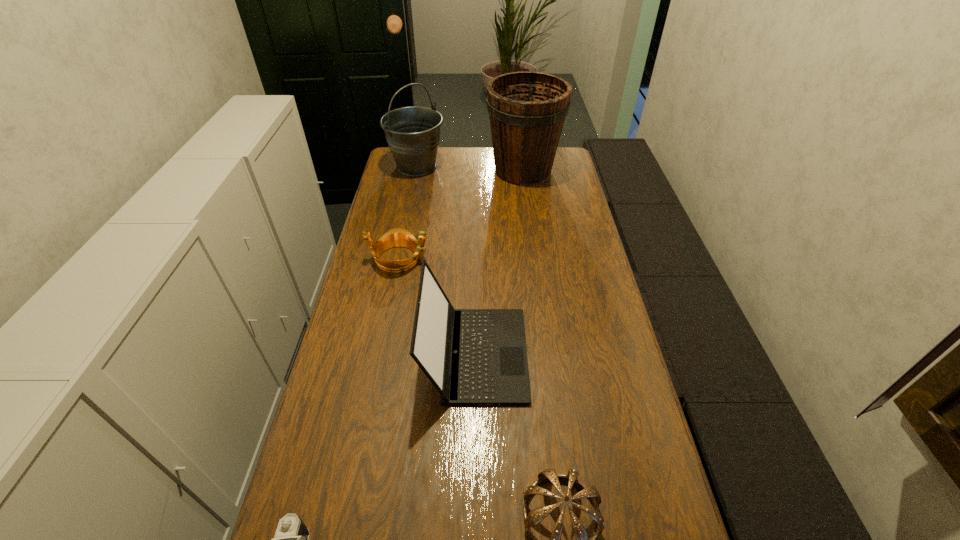
I want to click on bucket positioned at the left edge, so click(412, 133).

Locate an element on the screen. The height and width of the screenshot is (540, 960). tiara located at the left edge is located at coordinates [x=397, y=237].

I want to click on object present at the right edge, so click(527, 110).

At what (x,y) coordinates should I click in order to perform the action: click on object at the far left corner. Please return your answer as a coordinate pair (x, y). Looking at the image, I should click on (412, 133).

At what (x,y) coordinates should I click in order to perform the action: click on object positioned at the far right corner. Please return your answer as a coordinate pair (x, y). This screenshot has height=540, width=960. Looking at the image, I should click on (527, 110).

Where is `free spot at the far edge of the desktop`? The height and width of the screenshot is (540, 960). free spot at the far edge of the desktop is located at coordinates (466, 151).

This screenshot has height=540, width=960. In order to click on vacant region at the left edge of the desktop in this screenshot , I will do `click(383, 292)`.

Where is `free space at the right edge of the desktop`? The width and height of the screenshot is (960, 540). free space at the right edge of the desktop is located at coordinates (567, 201).

Where is `free space between the laptop and the left bucket`? The width and height of the screenshot is (960, 540). free space between the laptop and the left bucket is located at coordinates (446, 260).

Locate an element on the screen. This screenshot has height=540, width=960. free spot between the left bucket and the farther tiara is located at coordinates (408, 212).